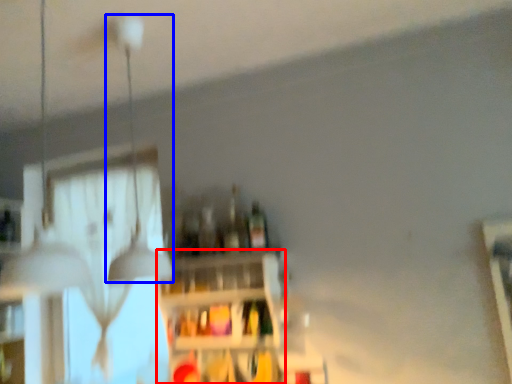
Question: Which of the following is the farthest to the observer, shelf (highlighted by a red box) or lamp (highlighted by a blue box)?

Choices:
 (A) shelf
 (B) lamp

Answer: (A)